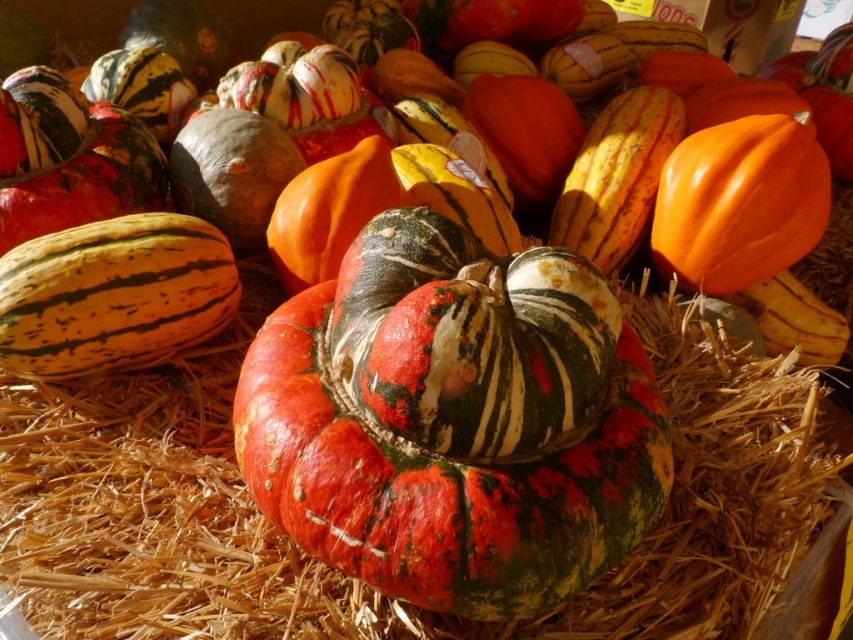
Question: From the image, what is the correct spatial relationship of textured straw at center in relation to speckled orange and green gourd at center?

Choices:
 (A) right
 (B) left

Answer: (A)

Question: Is textured straw at center in front of speckled orange and green gourd at center?

Choices:
 (A) no
 (B) yes

Answer: (A)

Question: Observing the image, what is the correct spatial positioning of textured straw at center in reference to speckled orange and green gourd at center?

Choices:
 (A) right
 (B) left

Answer: (A)

Question: Which object is farther from the camera taking this photo?

Choices:
 (A) textured straw at center
 (B) speckled orange and green gourd at center

Answer: (A)

Question: Which point is farther from the camera taking this photo?

Choices:
 (A) (297, 456)
 (B) (215, 605)

Answer: (B)